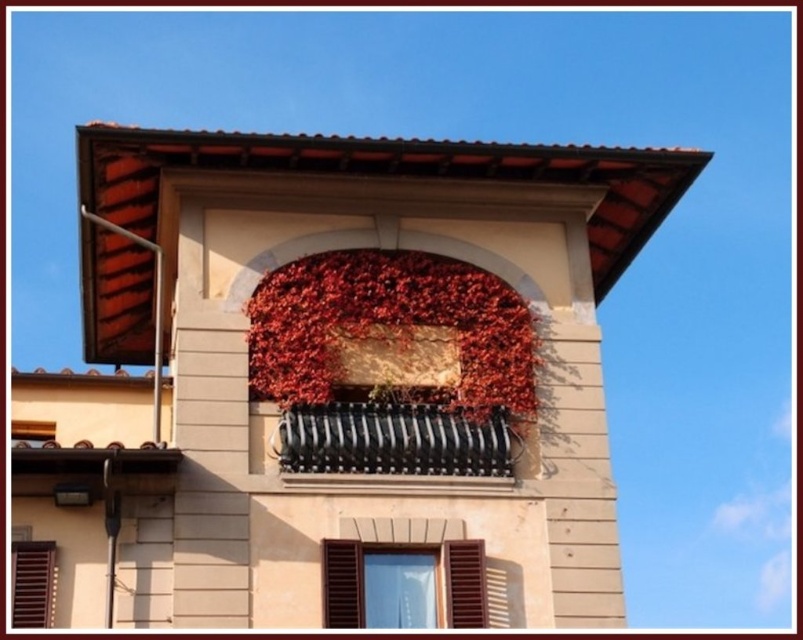
You are standing in front of the building and want to touch the dried red leaves at center and the black metal railing at center. Which object will you reach first?

The dried red leaves at center will be reached first because they are closer to you than the black metal railing at center.

You are a painter who needs to place a ladder to paint the black metal railing at center and the matte black window box at upper center. Since the window box is higher up, which object should you start painting first?

The matte black window box at upper center should be painted first because it is positioned higher than the black metal railing at center.